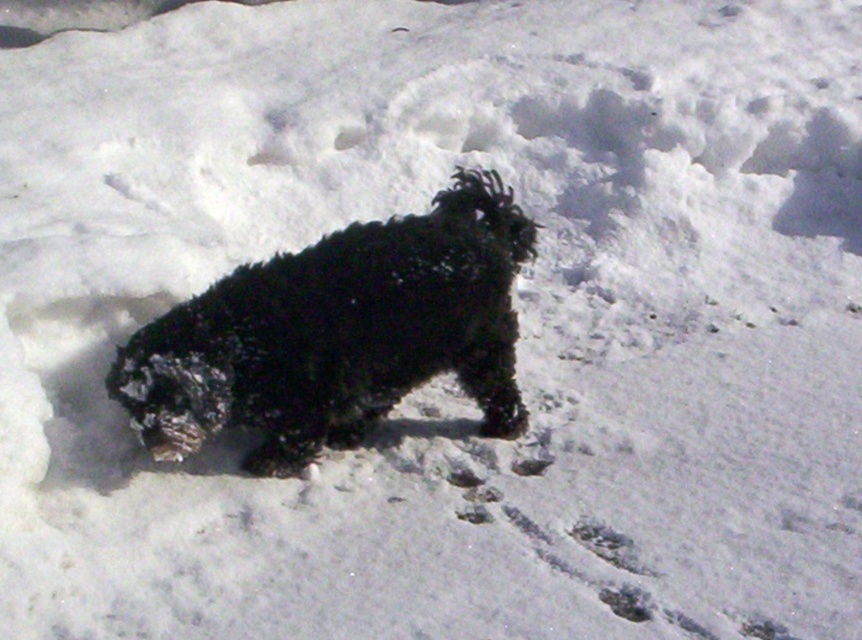
You are a photographer trying to capture the black fluffy dog at center in the snow. Since the white powdery snow at center reflects a lot of light, will the dog be easier or harder to see in the photo compared to the snow?

The black fluffy dog at center is bigger than white powdery snow at center, so the dog will be easier to see in the photo because its larger size contrasts with the smaller snow area.

You are standing in a snowy field and see the black fluffy dog at center and the white powdery snow at center. Which object is positioned more to the left?

The black fluffy dog at center is positioned more to the left than the white powdery snow at center.

You are a dog owner who wants to ensure your black fluffy dog at center stays warm while standing on the white powdery snow at center. Given the distance between them is 27.46 inches, is the dog sufficiently elevated to avoid direct contact with the snow?

The black fluffy dog at center is 27.46 inches away from the white powdery snow at center, meaning it is elevated enough to avoid direct contact with the snow, thus staying warm.